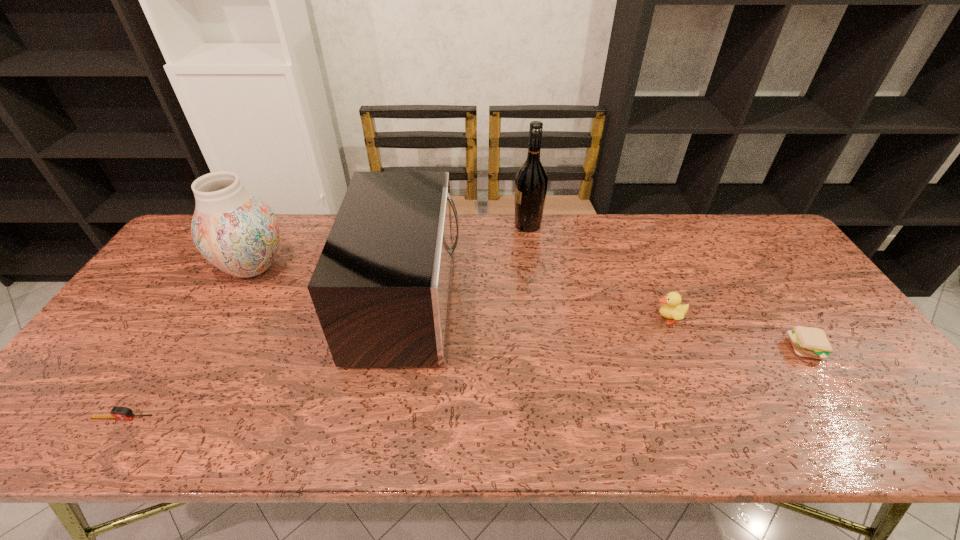
Image resolution: width=960 pixels, height=540 pixels. Find the location of `the farthest object`. the farthest object is located at coordinates (531, 181).

This screenshot has width=960, height=540. Find the location of `the tallest object`. the tallest object is located at coordinates (531, 181).

I want to click on vase, so click(x=237, y=232).

Locate an element on the screen. the fourth object from right to left is located at coordinates (381, 288).

Find the location of a particular element. This screenshot has height=540, width=960. duckling is located at coordinates (672, 309).

This screenshot has height=540, width=960. What are the coordinates of `the fourth tallest object` in the screenshot? It's located at (672, 309).

Image resolution: width=960 pixels, height=540 pixels. I want to click on the rightmost object, so click(x=810, y=342).

Find the location of a particular element. patty is located at coordinates (810, 342).

Locate an element on the screen. Image resolution: width=960 pixels, height=540 pixels. the nearest object is located at coordinates (120, 413).

Where is `the shortest object`? The image size is (960, 540). the shortest object is located at coordinates (120, 413).